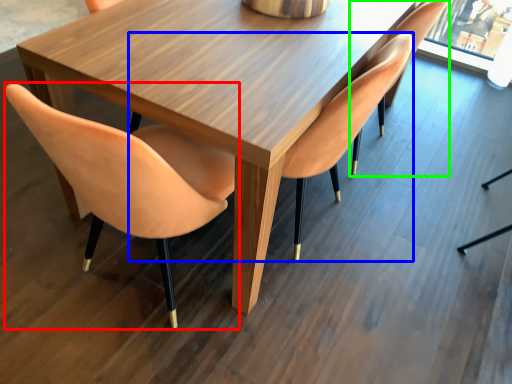
Question: Estimate the real-world distances between objects in this image. Which object is farther from chair (highlighted by a red box), chair (highlighted by a blue box) or chair (highlighted by a green box)?

Choices:
 (A) chair
 (B) chair

Answer: (B)